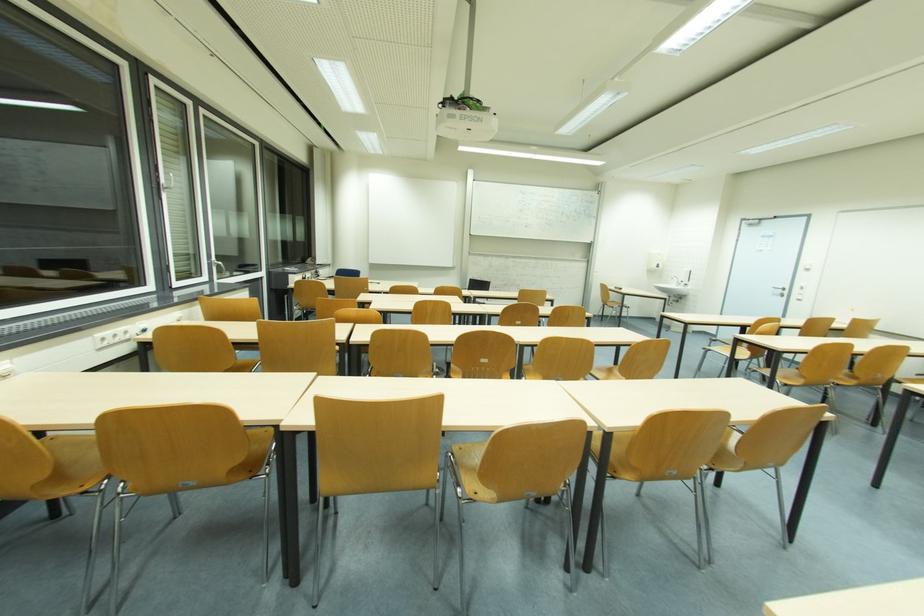
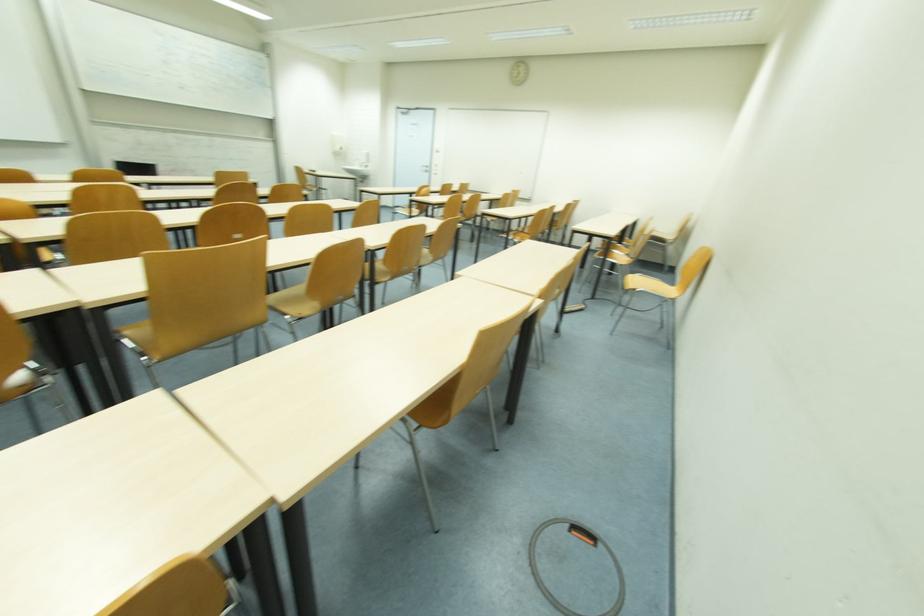
Based on the continuous images, in which direction is the camera rotating?

The camera's rotation is toward right-down.